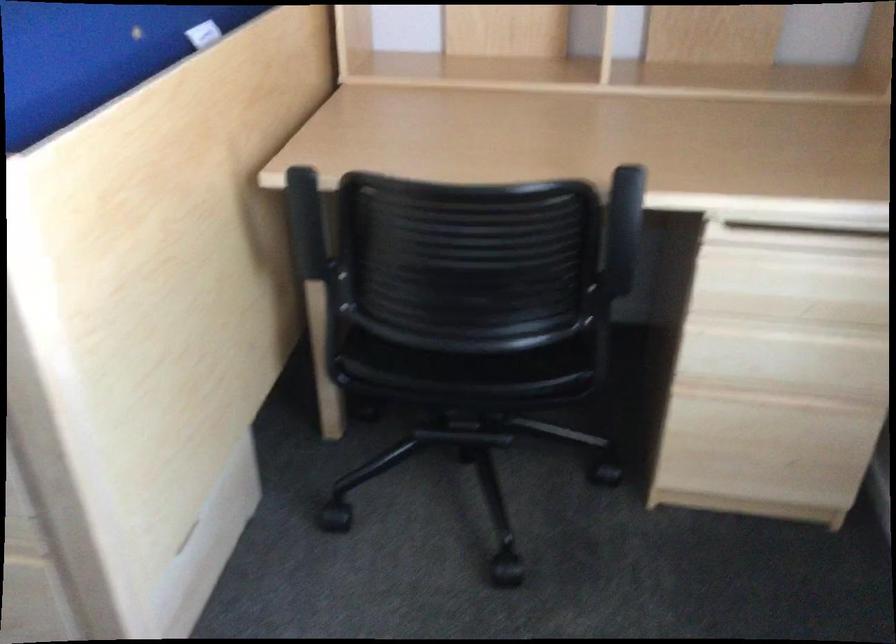
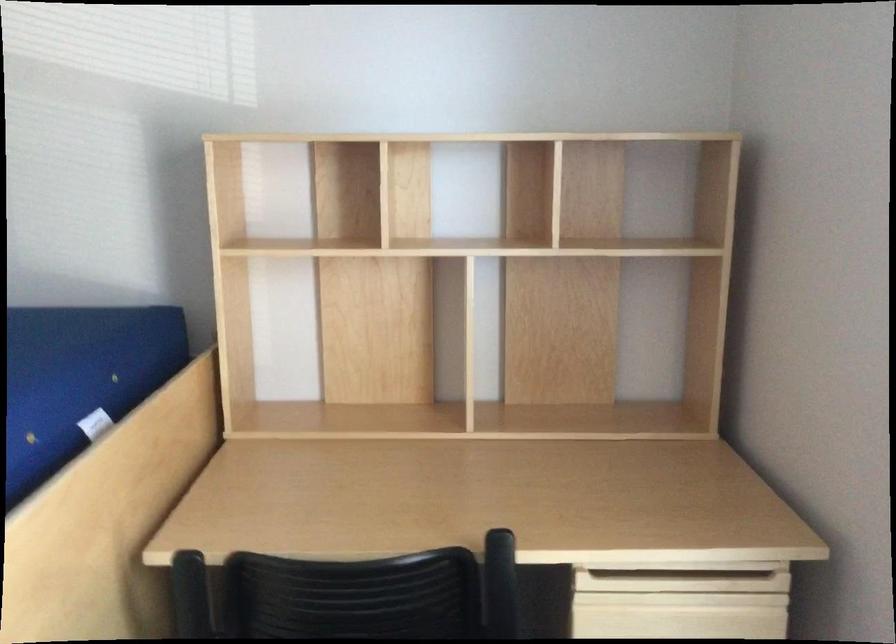
Question: Which direction would the cameraman need to move to produce the second image? Reply with the corresponding letter.

Choices:
 (A) Left
 (B) Right
 (C) Forward
 (D) Backward

Answer: (D)